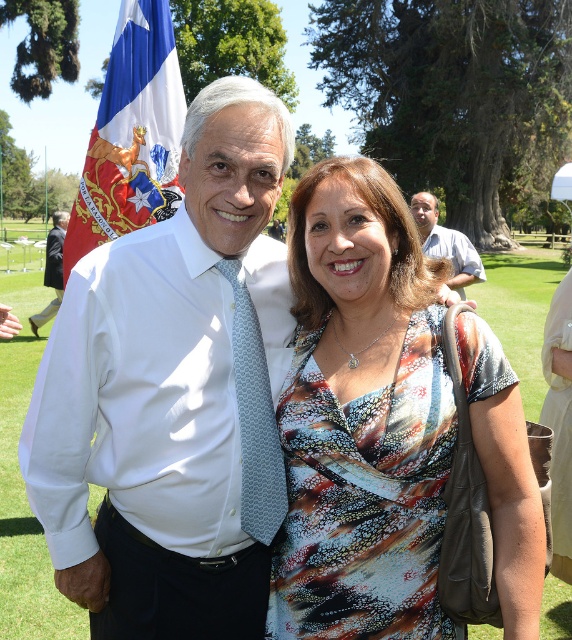
Is printed fabric dress at center to the right of light blue patterned tie at center from the viewer's perspective?

Yes, printed fabric dress at center is to the right of light blue patterned tie at center.

Is printed fabric dress at center behind light blue patterned tie at center?

No, it is in front of light blue patterned tie at center.

Is point (319, 621) positioned behind point (244, 442)?

That is False.

You are a GUI agent. You are given a task and a screenshot of the screen. Output one action in this format:
    pyautogui.click(x=<x>, y=<y>)
    Task: Click on the printed fabric dress at center
    This screenshot has height=640, width=572.
    Given the screenshot: What is the action you would take?
    pyautogui.click(x=362, y=417)

Is printed fabric dress at center to the right of blue fabric flag at left from the viewer's perspective?

Yes, printed fabric dress at center is to the right of blue fabric flag at left.

This screenshot has width=572, height=640. Describe the element at coordinates (362, 417) in the screenshot. I see `printed fabric dress at center` at that location.

The width and height of the screenshot is (572, 640). I want to click on printed fabric dress at center, so click(362, 417).

Does white smooth shirt at center have a greater width compared to printed fabric dress at center?

Correct, the width of white smooth shirt at center exceeds that of printed fabric dress at center.

From the picture: Can you confirm if white smooth shirt at center is thinner than printed fabric dress at center?

No, white smooth shirt at center is not thinner than printed fabric dress at center.

Does point (208, 305) come in front of point (419, 304)?

No, it is not.

Locate an element on the screen. The image size is (572, 640). white smooth shirt at center is located at coordinates (173, 394).